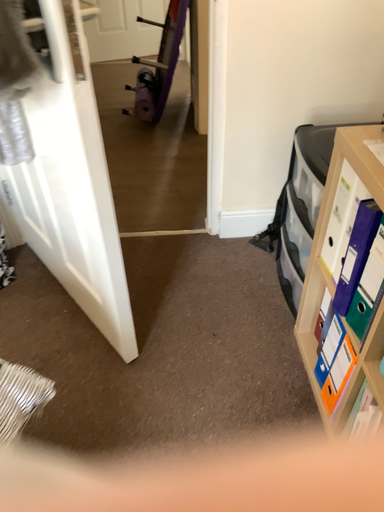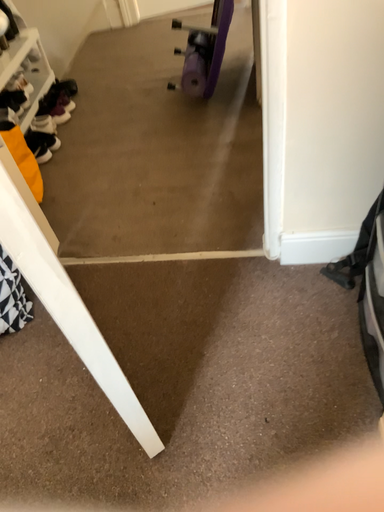
Question: Which way did the camera rotate in the video?

Choices:
 (A) rotated upward
 (B) rotated downward

Answer: (B)